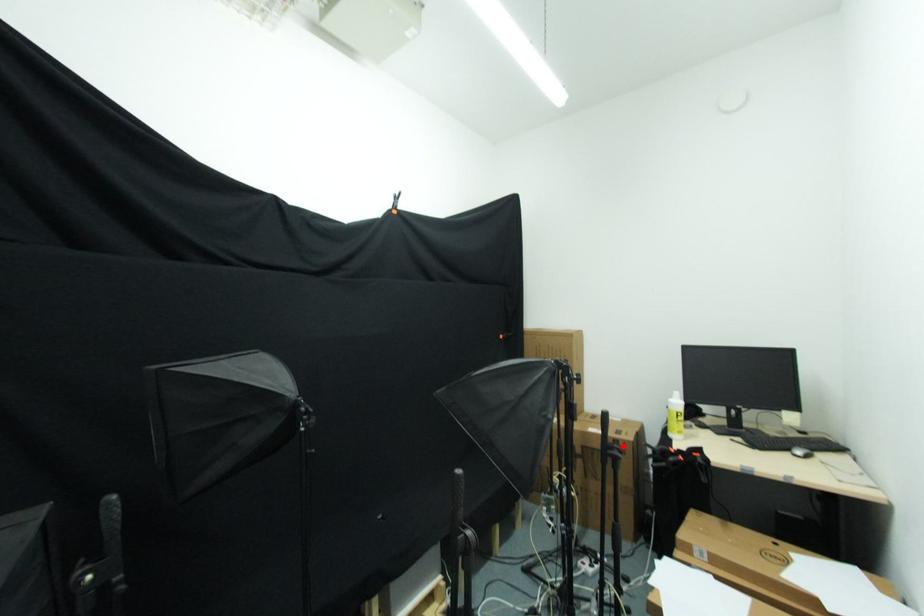
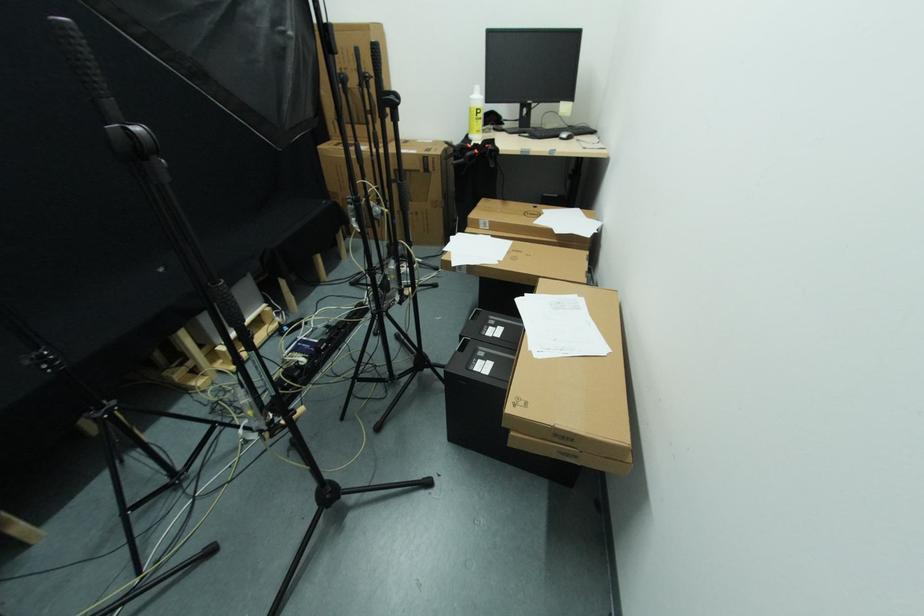
Question: I am providing you with two images of the same scene from different viewpoints. A red point is marked on the first image. Is the red point's position out of view in image 2?

Choices:
 (A) Yes
 (B) No

Answer: (B)